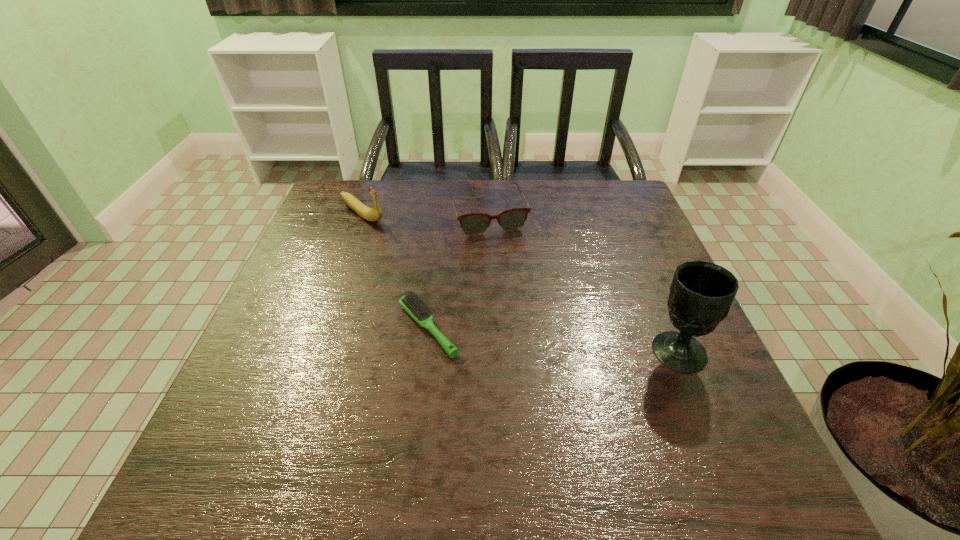
The image size is (960, 540). Identify the location of free space located 0.260m at the front view of the second shortest object. pyautogui.click(x=523, y=306).

You are a GUI agent. You are given a task and a screenshot of the screen. Output one action in this format:
    pyautogui.click(x=<x>, y=<y>)
    Task: Click on the vacant space located at the stem of the third shortest object
    Image resolution: width=960 pixels, height=540 pixels.
    Given the screenshot: What is the action you would take?
    pyautogui.click(x=396, y=238)

Identify the location of vacant area situated at the stem of the third shortest object. The width and height of the screenshot is (960, 540). (454, 279).

Where is `vacant area situated 0.150m at the stem of the third shortest object`? The width and height of the screenshot is (960, 540). vacant area situated 0.150m at the stem of the third shortest object is located at coordinates (410, 247).

Where is `spectacles that is at the far edge`? spectacles that is at the far edge is located at coordinates (512, 219).

Identify the location of banana that is at the far edge. The image size is (960, 540). (373, 214).

Locate an element on the screen. object situated at the left edge is located at coordinates (373, 214).

Identify the location of object situated at the right edge. The image size is (960, 540). (701, 294).

This screenshot has width=960, height=540. I want to click on object that is at the far left corner, so click(373, 214).

Where is `vacant position at the far edge of the desktop`? vacant position at the far edge of the desktop is located at coordinates (547, 222).